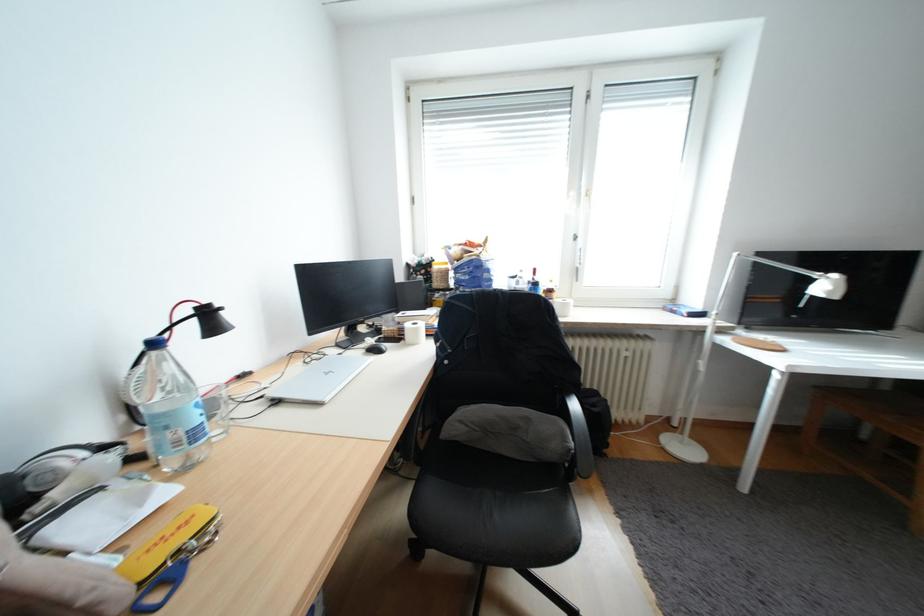
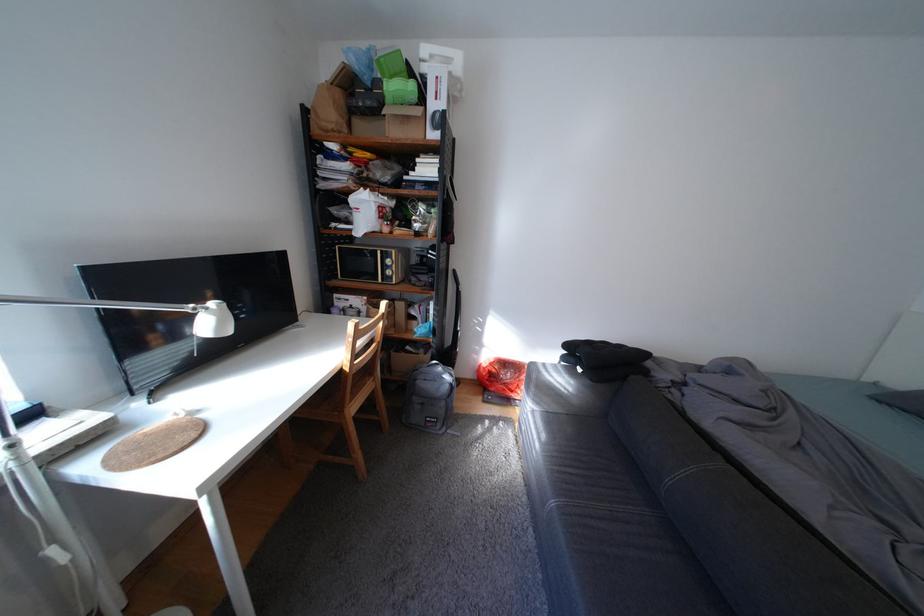
In the second image, find the point that corresponds to [846,276] in the first image.

(225, 305)